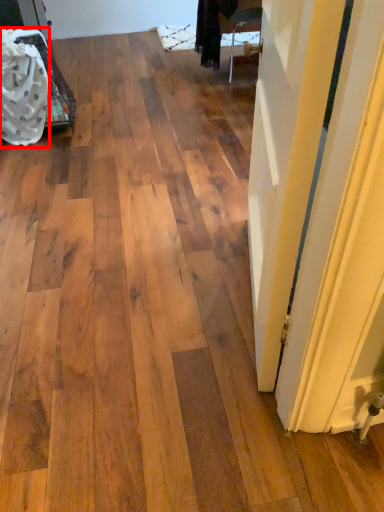
Question: Considering the relative positions of material (annotated by the red box) and door in the image provided, where is material (annotated by the red box) located with respect to the staircase?

Choices:
 (A) left
 (B) right

Answer: (A)